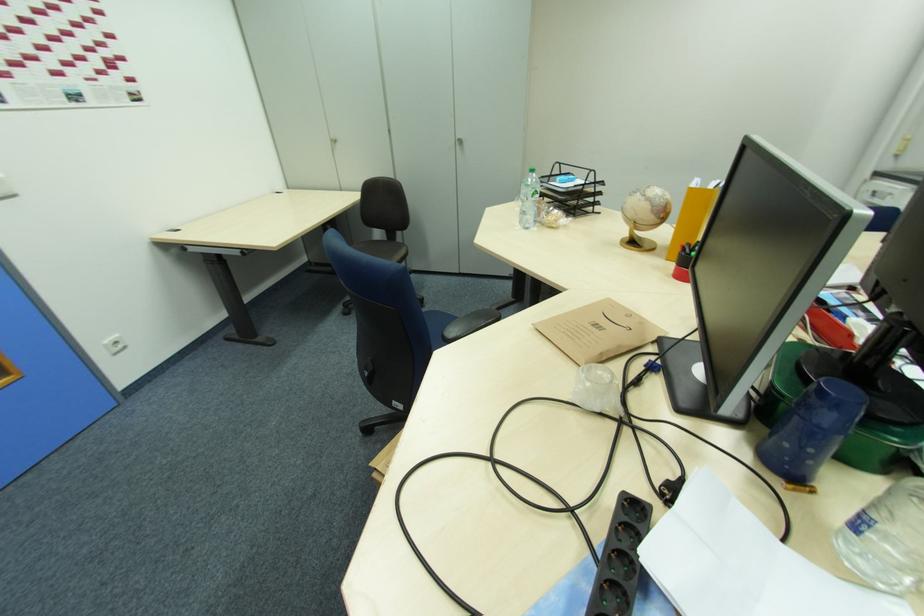
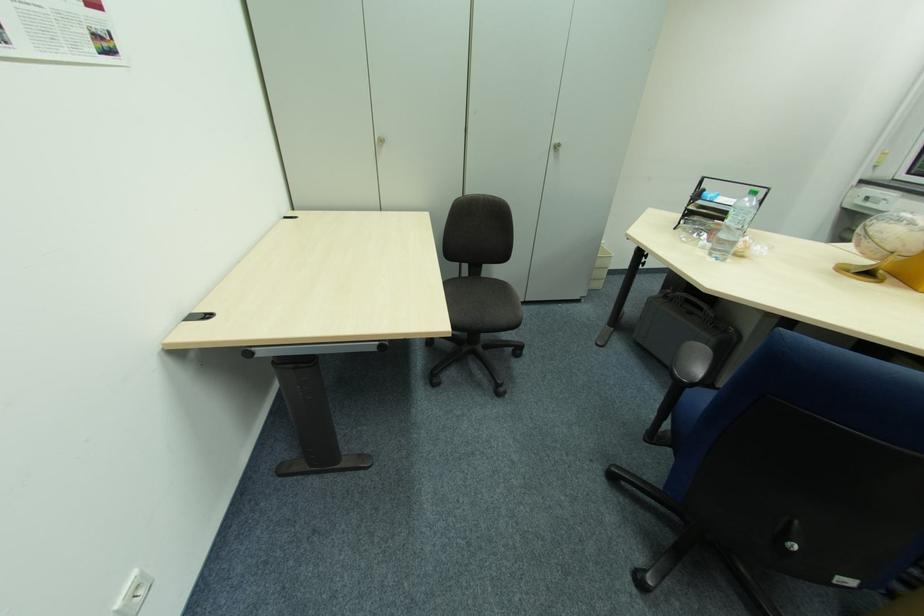
Locate, in the second image, the point that corresponds to pixel 462 144 in the first image.

(554, 150)